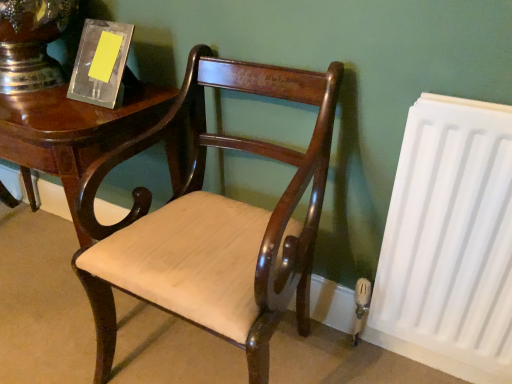
You are a GUI agent. You are given a task and a screenshot of the screen. Output one action in this format:
    pyautogui.click(x=<x>, y=<y>)
    Task: Click on the vacant space underneath white matte radiator at right (from a real-world perspective)
    
    Given the screenshot: What is the action you would take?
    pyautogui.click(x=402, y=364)